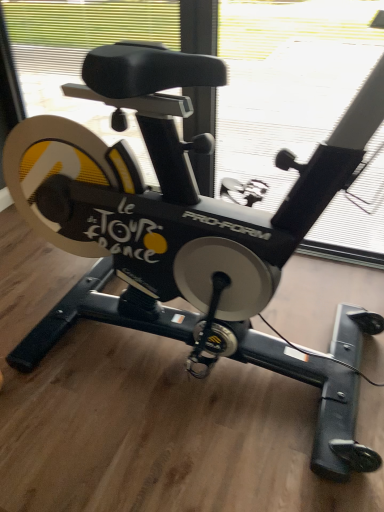
Question: Which direction should I rotate to face transparent plastic window screen at upper center, the first window screen from the front, — up or down?

Choices:
 (A) up
 (B) down

Answer: (A)

Question: Does transparent plastic window screen at upper center, placed as the second window screen when sorted from back to front, turn towards transparent plastic window screen at upper center, which ranks as the first window screen in back-to-front order?

Choices:
 (A) yes
 (B) no

Answer: (B)

Question: Can you confirm if transparent plastic window screen at upper center, placed as the second window screen when sorted from back to front, is bigger than transparent plastic window screen at upper center, which ranks as the first window screen in back-to-front order?

Choices:
 (A) yes
 (B) no

Answer: (A)

Question: Considering the relative sizes of transparent plastic window screen at upper center, the first window screen from the front, and transparent plastic window screen at upper center, which ranks as the first window screen in back-to-front order, in the image provided, is transparent plastic window screen at upper center, the first window screen from the front, wider than transparent plastic window screen at upper center, which ranks as the first window screen in back-to-front order,?

Choices:
 (A) no
 (B) yes

Answer: (B)

Question: From the image's perspective, is transparent plastic window screen at upper center, placed as the second window screen when sorted from back to front, on top of transparent plastic window screen at upper center, the second window screen from the front?

Choices:
 (A) no
 (B) yes

Answer: (A)

Question: Can transparent plastic window screen at upper center, which ranks as the first window screen in back-to-front order, be found inside transparent plastic window screen at upper center, placed as the second window screen when sorted from back to front?

Choices:
 (A) no
 (B) yes

Answer: (A)

Question: Is there a large distance between transparent plastic window screen at upper center, the first window screen from the front, and transparent plastic window screen at upper center, the second window screen from the front?

Choices:
 (A) yes
 (B) no

Answer: (B)

Question: Is transparent plastic window screen at upper center, which ranks as the first window screen in back-to-front order, to the right of transparent plastic window screen at upper center, the first window screen from the front, from the viewer's perspective?

Choices:
 (A) no
 (B) yes

Answer: (B)

Question: Is transparent plastic window screen at upper center, which ranks as the first window screen in back-to-front order, outside transparent plastic window screen at upper center, the first window screen from the front?

Choices:
 (A) no
 (B) yes

Answer: (B)

Question: Does transparent plastic window screen at upper center, the second window screen from the front, have a larger size compared to transparent plastic window screen at upper center, the first window screen from the front?

Choices:
 (A) yes
 (B) no

Answer: (B)

Question: Can you confirm if transparent plastic window screen at upper center, the second window screen from the front, is shorter than transparent plastic window screen at upper center, placed as the second window screen when sorted from back to front?

Choices:
 (A) no
 (B) yes

Answer: (B)

Question: Is transparent plastic window screen at upper center, the second window screen from the front, at the left side of transparent plastic window screen at upper center, placed as the second window screen when sorted from back to front?

Choices:
 (A) no
 (B) yes

Answer: (A)

Question: Does transparent plastic window screen at upper center, which ranks as the first window screen in back-to-front order, turn towards transparent plastic window screen at upper center, the first window screen from the front?

Choices:
 (A) yes
 (B) no

Answer: (A)

Question: Based on their sizes in the image, would you say transparent plastic window screen at upper center, the first window screen from the front, is bigger or smaller than transparent plastic window screen at upper center, which ranks as the first window screen in back-to-front order?

Choices:
 (A) big
 (B) small

Answer: (A)